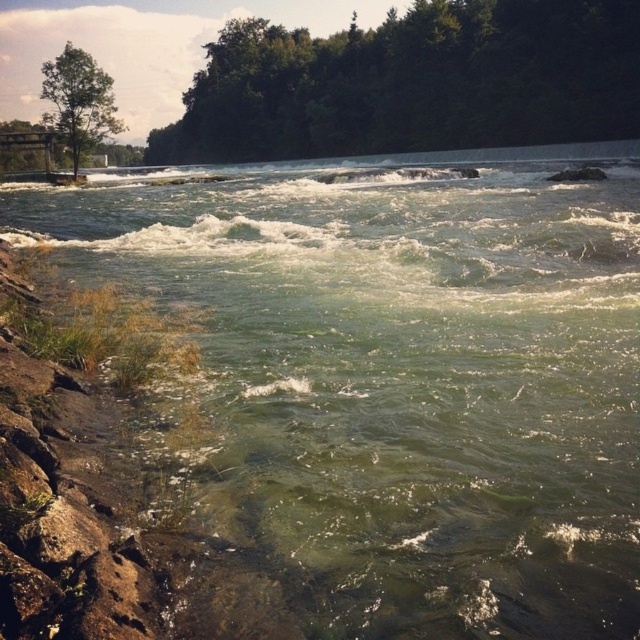
Question: Among these objects, which one is nearest to the camera?

Choices:
 (A) green leafy tree at upper center
 (B) green matte tree at upper left

Answer: (B)

Question: Where is green leafy tree at upper center located in relation to green matte tree at upper left in the image?

Choices:
 (A) above
 (B) below

Answer: (B)

Question: Which point is closer to the camera?

Choices:
 (A) (276, 100)
 (B) (104, 134)

Answer: (B)

Question: From the image, what is the correct spatial relationship of green leafy tree at upper center in relation to green matte tree at upper left?

Choices:
 (A) below
 (B) above

Answer: (A)

Question: Which point is closer to the camera taking this photo?

Choices:
 (A) (99, 125)
 (B) (509, 138)

Answer: (A)

Question: Does green leafy tree at upper center appear under green matte tree at upper left?

Choices:
 (A) no
 (B) yes

Answer: (B)